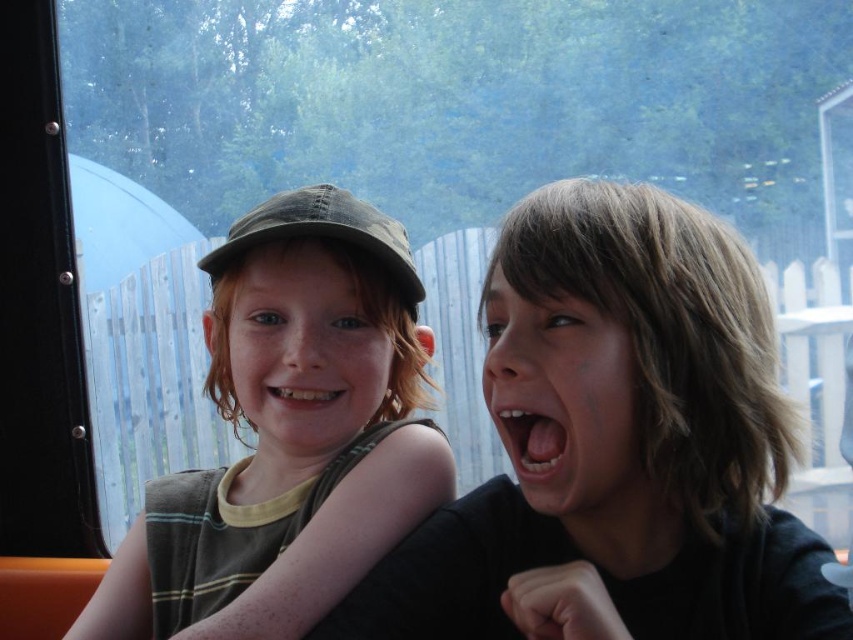
Question: Can you confirm if matte black cap at upper left is positioned below smooth skin face at center?

Choices:
 (A) yes
 (B) no

Answer: (B)

Question: Can you confirm if matte black shirt at center is bigger than matte black cap at upper left?

Choices:
 (A) no
 (B) yes

Answer: (B)

Question: Which object is positioned farthest from the matte green cap at left?

Choices:
 (A) matte black cap at upper left
 (B) white glossy teeth at center
 (C) smooth white teeth at center

Answer: (C)

Question: Which object is closer to the camera taking this photo?

Choices:
 (A) smooth white teeth at center
 (B) matte black shirt at center

Answer: (B)

Question: Which of these objects is positioned farthest from the white glossy teeth at center?

Choices:
 (A) smooth white teeth at center
 (B) matte black cap at upper left
 (C) matte black shirt at center
 (D) matte green cap at left

Answer: (C)

Question: Can you confirm if matte black shirt at center is thinner than smooth skin face at center?

Choices:
 (A) yes
 (B) no

Answer: (B)